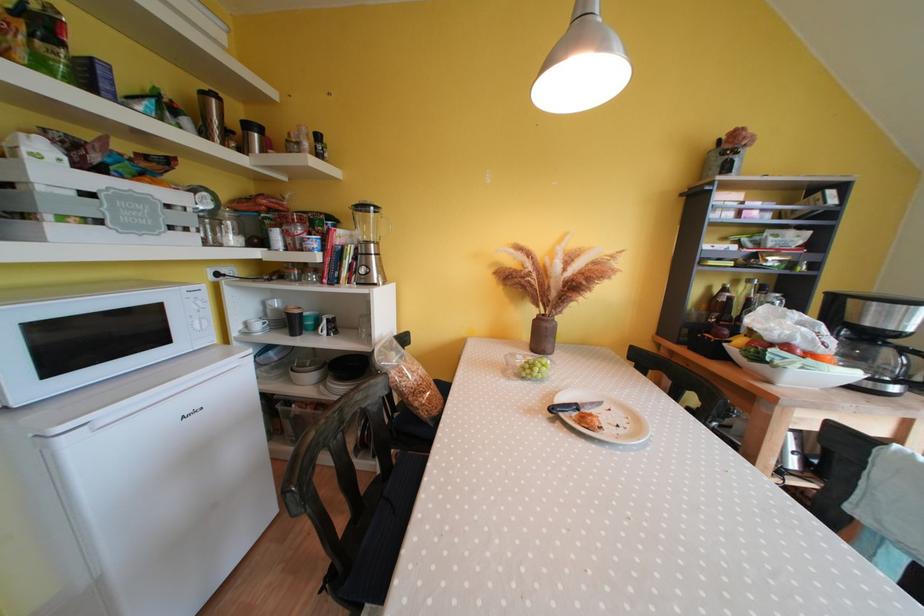
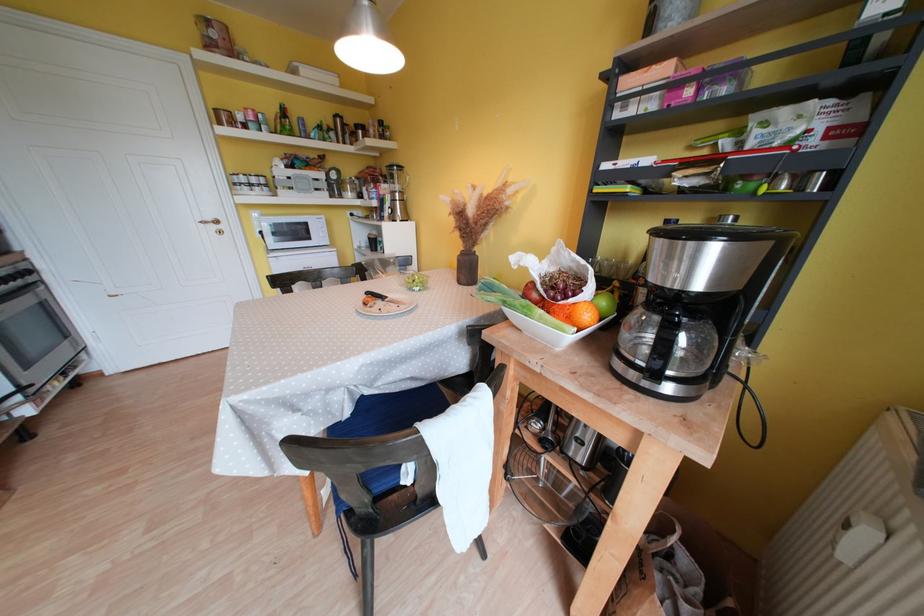
The point at (x=805, y=355) is marked in the first image. Where is the corresponding point in the second image?

(541, 299)